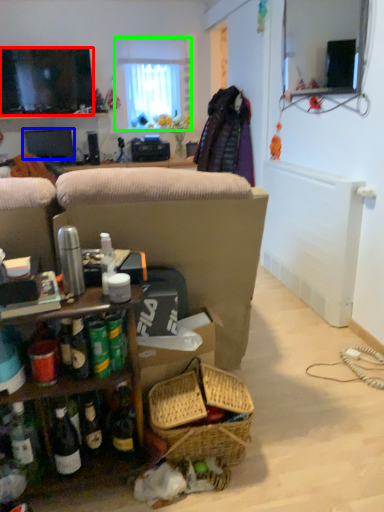
Question: Considering the real-world distances, which object is closest to television (highlighted by a red box)? television (highlighted by a blue box) or window (highlighted by a green box).

Choices:
 (A) television
 (B) window

Answer: (A)